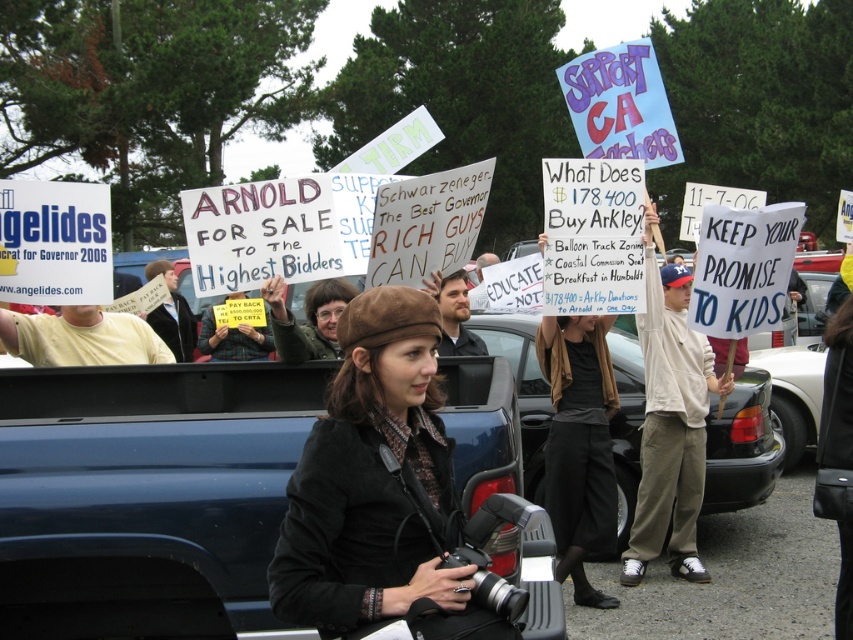
Question: Is brown suede beret at center to the left of black cotton pants at center from the viewer's perspective?

Choices:
 (A) yes
 (B) no

Answer: (A)

Question: Does brown suede beret at center have a lesser width compared to white fabric hoodie at center?

Choices:
 (A) no
 (B) yes

Answer: (B)

Question: Does brown suede beret at center appear over black glossy car at center?

Choices:
 (A) no
 (B) yes

Answer: (B)

Question: Which of the following is the closest to the observer?

Choices:
 (A) (289, 504)
 (B) (660, 307)

Answer: (A)

Question: Among these points, which one is farthest from the camera?

Choices:
 (A) (596, 401)
 (B) (677, 340)
 (C) (618, 428)
 (D) (424, 307)

Answer: (C)

Question: Which object is closer to the camera taking this photo?

Choices:
 (A) white fabric hoodie at center
 (B) black glossy car at center

Answer: (A)